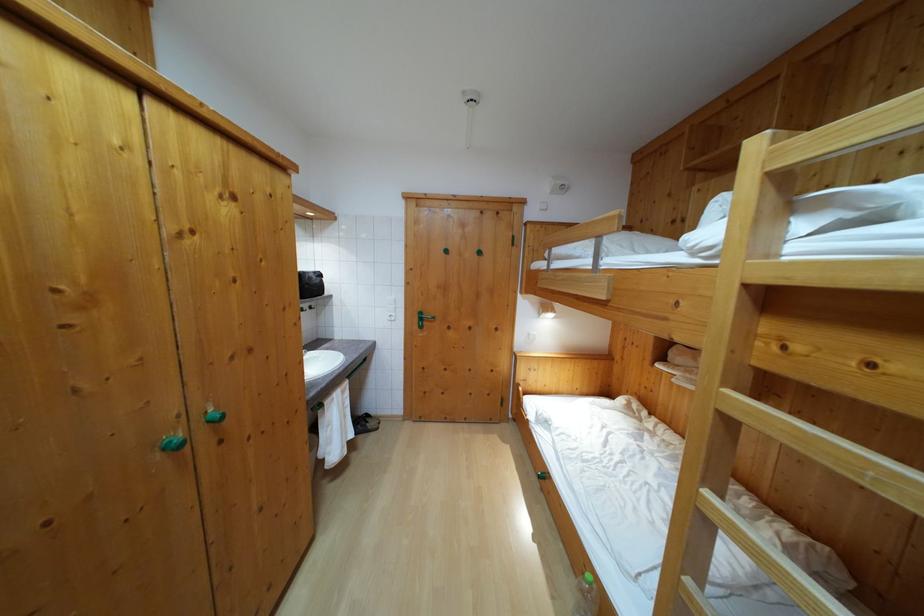
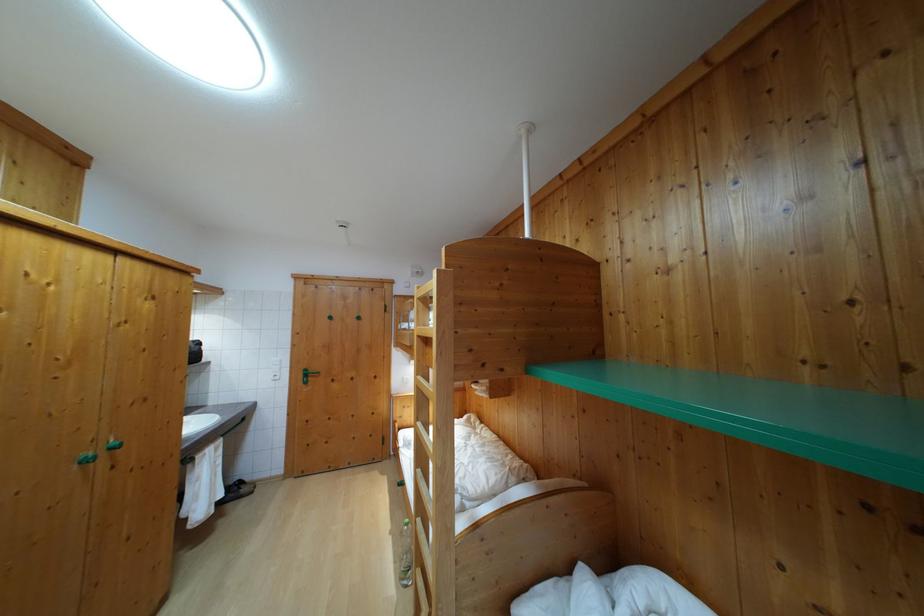
In a continuous first-person perspective shot, in which direction is the camera moving?

The cameraman moved toward right, backward.